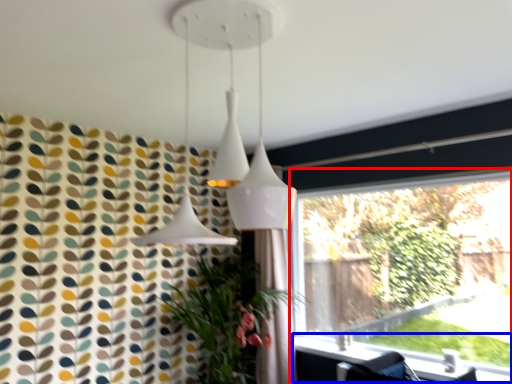
Question: Which object is further to the camera taking this photo, window (highlighted by a red box) or window sill (highlighted by a blue box)?

Choices:
 (A) window
 (B) window sill

Answer: (A)